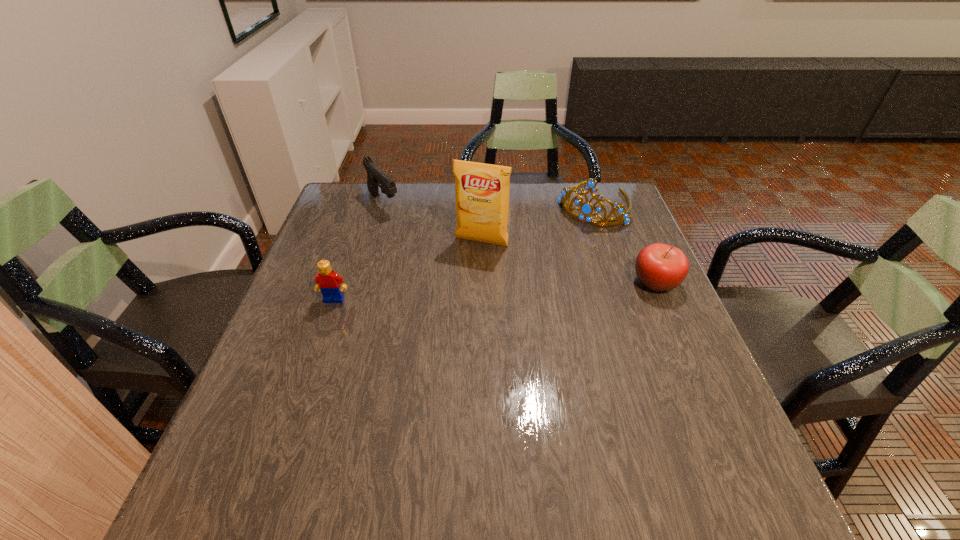
Find the location of a particular element. The height and width of the screenshot is (540, 960). free location located 0.100m on the front of the crisp (potato chip) with the logo is located at coordinates (464, 275).

Locate an element on the screen. The image size is (960, 540). vacant space located at the barrel of the pistol is located at coordinates (429, 253).

Image resolution: width=960 pixels, height=540 pixels. Identify the location of free location located 0.280m at the barrel of the pistol. (441, 265).

This screenshot has width=960, height=540. What are the coordinates of `vacant position located 0.270m at the barrel of the pistol` in the screenshot? It's located at coord(439,262).

Find the location of a particular element. The height and width of the screenshot is (540, 960). free spot located on the front-facing side of the tiara is located at coordinates (546, 265).

I want to click on blank space located on the front-facing side of the tiara, so (x=558, y=251).

This screenshot has height=540, width=960. What are the coordinates of `vacant space located 0.210m on the front-facing side of the tiara` in the screenshot? It's located at (548, 263).

Locate an element on the screen. pistol at the far edge is located at coordinates (375, 176).

Identify the location of tiara located at the far edge. (586, 209).

Find the location of a particular element. The image size is (960, 540). Lego located in the left edge section of the desktop is located at coordinates (327, 281).